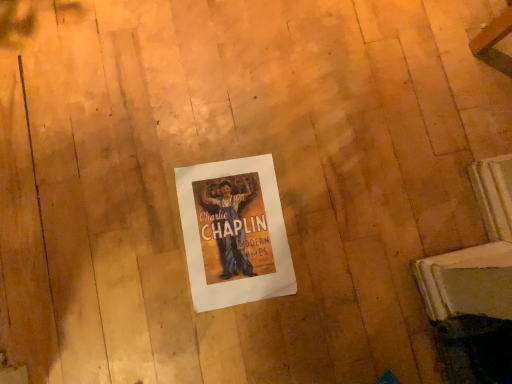
Where is `unoccupied space behind white paper poster at center`? unoccupied space behind white paper poster at center is located at coordinates (278, 131).